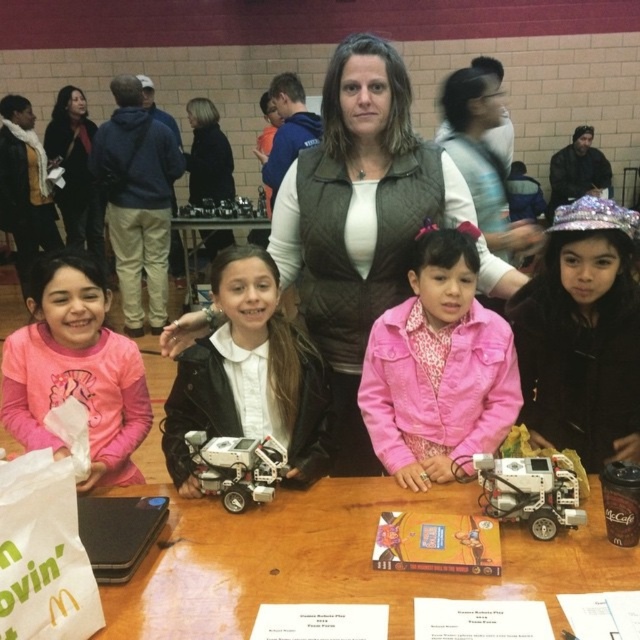
Between white textured sweater at center and silver metallic robot at center, which one appears on the left side from the viewer's perspective?

silver metallic robot at center

Does point (452, 122) come farther from viewer compared to point (496, 493)?

That is True.

Image resolution: width=640 pixels, height=640 pixels. What do you see at coordinates (483, 157) in the screenshot?
I see `white textured sweater at center` at bounding box center [483, 157].

Identify the location of white textured sweater at center. The height and width of the screenshot is (640, 640). (483, 157).

Can you confirm if pink corduroy jacket at center is shorter than silver metallic robot at center?

In fact, pink corduroy jacket at center may be taller than silver metallic robot at center.

Is point (436, 436) farther from viewer compared to point (570, 497)?

Yes.

Locate an element on the screen. The width and height of the screenshot is (640, 640). pink corduroy jacket at center is located at coordinates (438, 369).

Who is shorter, sparkly silver tiara at upper right or white plastic robot at center?

white plastic robot at center is shorter.

Between point (614, 300) and point (230, 458), which one is positioned behind?

Positioned behind is point (614, 300).

Which is behind, point (556, 340) or point (264, 500)?

The point (556, 340) is behind.

I want to click on sparkly silver tiara at upper right, so click(582, 333).